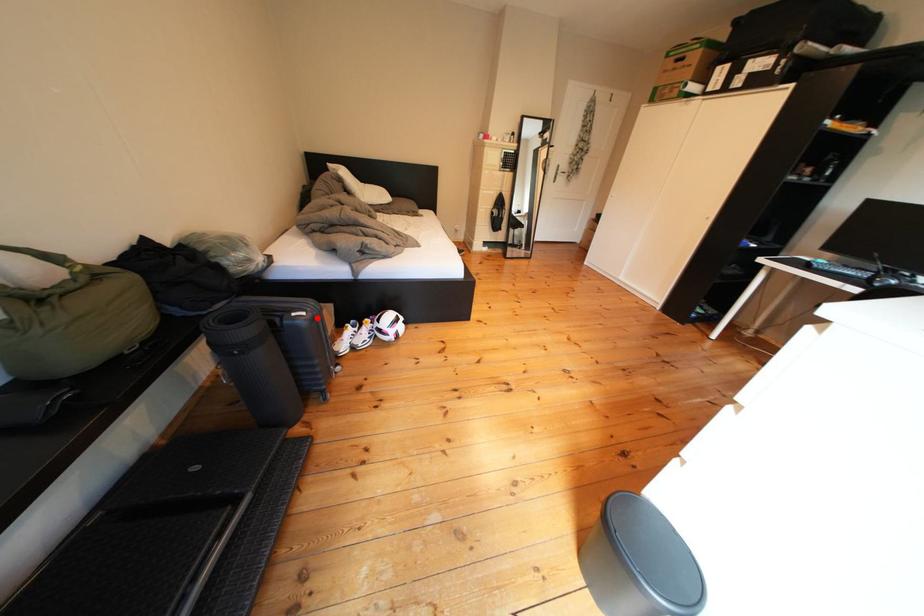
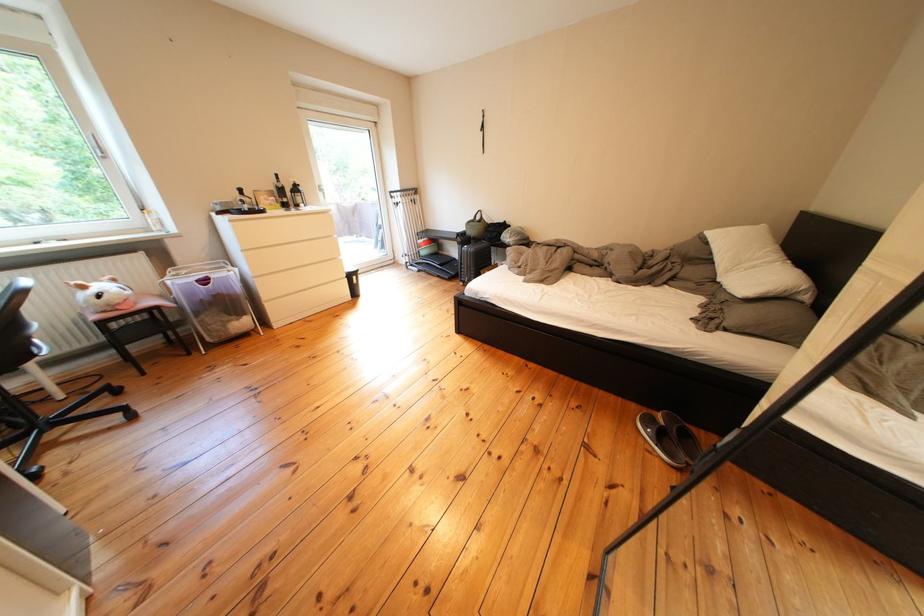
Question: A red point is marked in image1. In image2, is the corresponding 3D point closer to the camera or farther? Reply with the corresponding letter.

Choices:
 (A) The corresponding 3D point is closer.
 (B) The corresponding 3D point is farther.

Answer: (B)